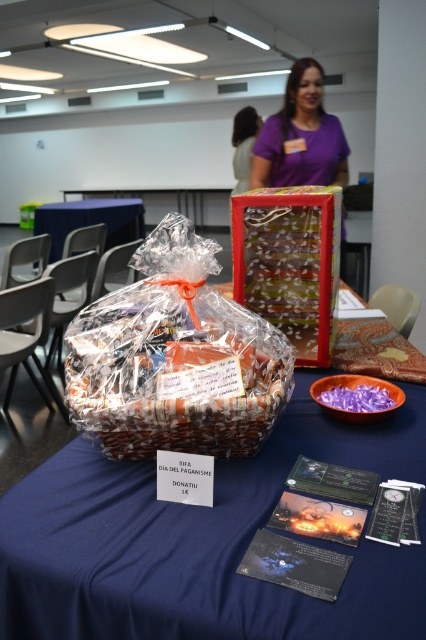
Question: From the image, what is the correct spatial relationship of blue fabric tablecloth at center in relation to plastic wrapped basket at center?

Choices:
 (A) below
 (B) above

Answer: (A)

Question: Which point appears closest to the camera in this image?

Choices:
 (A) (294, 160)
 (B) (388, 588)

Answer: (B)

Question: Is plastic wrapped basket at center above purple fabric at upper center?

Choices:
 (A) no
 (B) yes

Answer: (A)

Question: Which of the following is the farthest from the observer?

Choices:
 (A) (88, 337)
 (B) (201, 436)
 (C) (344, 148)
 (D) (60, 243)

Answer: (D)

Question: Is clear plastic bag at center to the left of blue fabric table at center from the viewer's perspective?

Choices:
 (A) yes
 (B) no

Answer: (B)

Question: Among these points, which one is farthest from the camera?

Choices:
 (A) (138, 211)
 (B) (296, 104)
 (C) (226, 371)

Answer: (A)